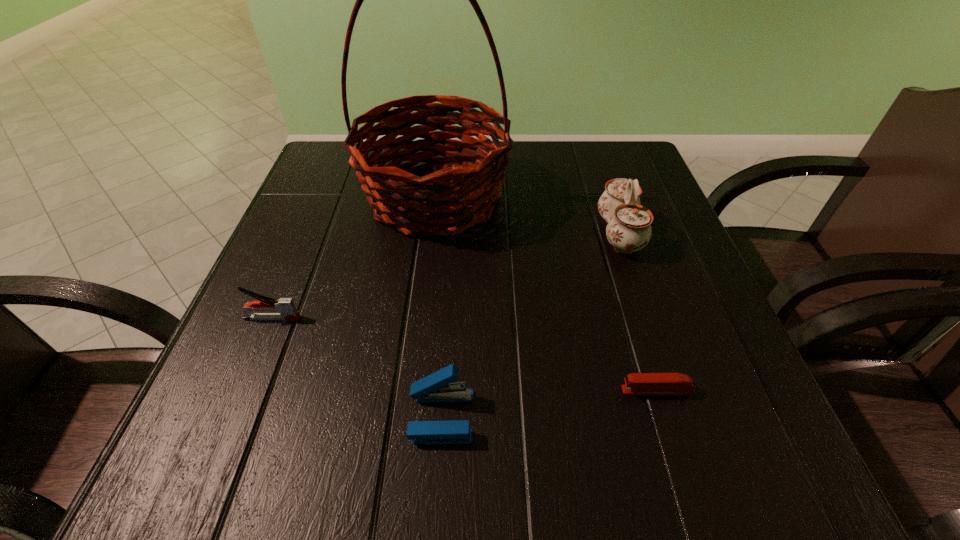
Locate an element on the screen. This screenshot has width=960, height=540. chinaware that is positioned at the right edge is located at coordinates (628, 230).

Where is `stapler at the right edge`? The width and height of the screenshot is (960, 540). stapler at the right edge is located at coordinates (635, 383).

Identify the location of object that is at the far left corner. The height and width of the screenshot is (540, 960). (448, 199).

Where is `free space at the far edge of the desktop`? This screenshot has width=960, height=540. free space at the far edge of the desktop is located at coordinates pyautogui.click(x=509, y=169).

Locate an element on the screen. The image size is (960, 540). free location at the near edge is located at coordinates (586, 448).

Where is `vacant space at the left edge of the desktop`? vacant space at the left edge of the desktop is located at coordinates (213, 372).

Locate an element on the screen. vacant space at the right edge of the desktop is located at coordinates (708, 337).

This screenshot has height=540, width=960. I want to click on vacant space at the far left corner, so click(x=336, y=181).

Where is `free space at the near left corner of the desktop`? Image resolution: width=960 pixels, height=540 pixels. free space at the near left corner of the desktop is located at coordinates (296, 461).

In the image, there is a desktop. Where is `vacant space at the far right corner`? This screenshot has width=960, height=540. vacant space at the far right corner is located at coordinates (592, 193).